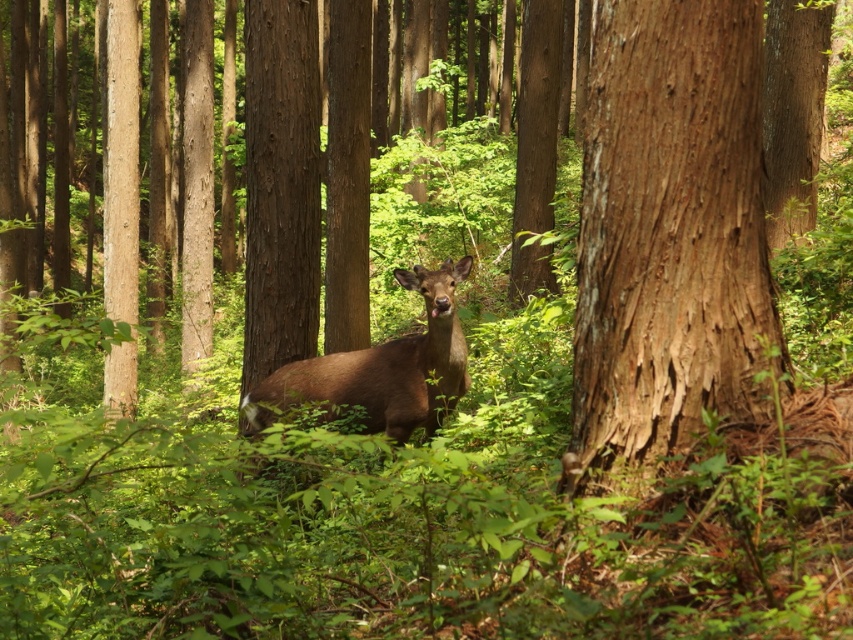
Who is positioned more to the left, brown textured bark at center or brown matte/deer at center?

brown matte/deer at center is more to the left.

Can you confirm if brown textured bark at center is shorter than brown matte/deer at center?

In fact, brown textured bark at center may be taller than brown matte/deer at center.

This screenshot has width=853, height=640. What are the coordinates of `brown textured bark at center` in the screenshot? It's located at (669, 236).